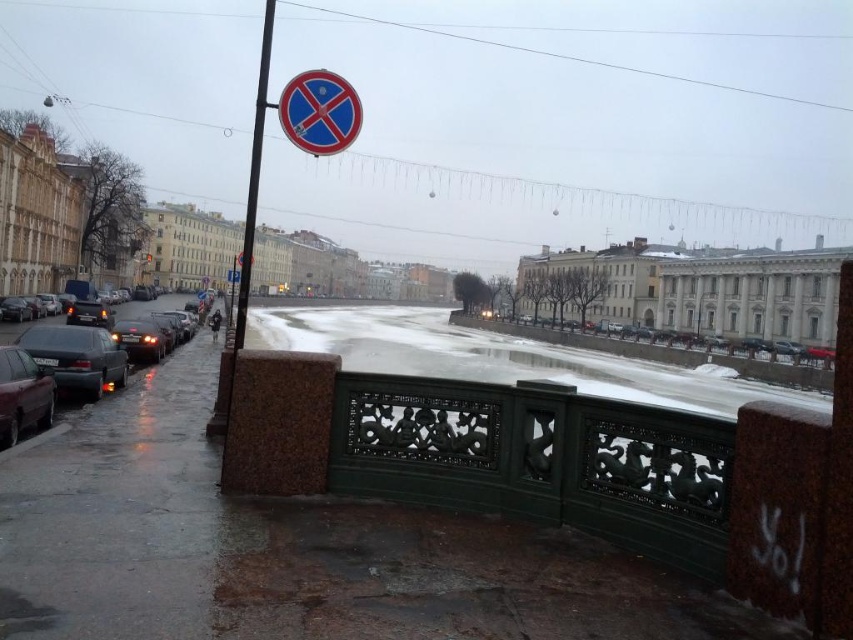
Who is more forward, (x=283, y=99) or (x=16, y=429)?

Point (x=283, y=99) is more forward.

Can you confirm if blue glossy circle at upper center is bigger than shiny black sedan at left?

Yes, blue glossy circle at upper center is bigger than shiny black sedan at left.

The width and height of the screenshot is (853, 640). What do you see at coordinates (318, 113) in the screenshot? I see `blue glossy circle at upper center` at bounding box center [318, 113].

Where is `blue glossy circle at upper center`? The height and width of the screenshot is (640, 853). blue glossy circle at upper center is located at coordinates click(318, 113).

Is point (44, 339) positioned after point (18, 412)?

Yes, point (44, 339) is behind point (18, 412).

Who is more distant from viewer, (44, 401) or (10, 355)?

The point (44, 401) is more distant.

This screenshot has height=640, width=853. I want to click on matte black car at left, so click(57, 372).

Which is more to the right, matte black car at left or polished metal pole at upper left?

matte black car at left is more to the right.

Which is behind, point (24, 416) or point (224, 397)?

The point (224, 397) is behind.

Does point (77, 356) come farther from viewer compared to point (227, 340)?

No, it is not.

Where is `matte black car at left`? This screenshot has width=853, height=640. matte black car at left is located at coordinates (57, 372).